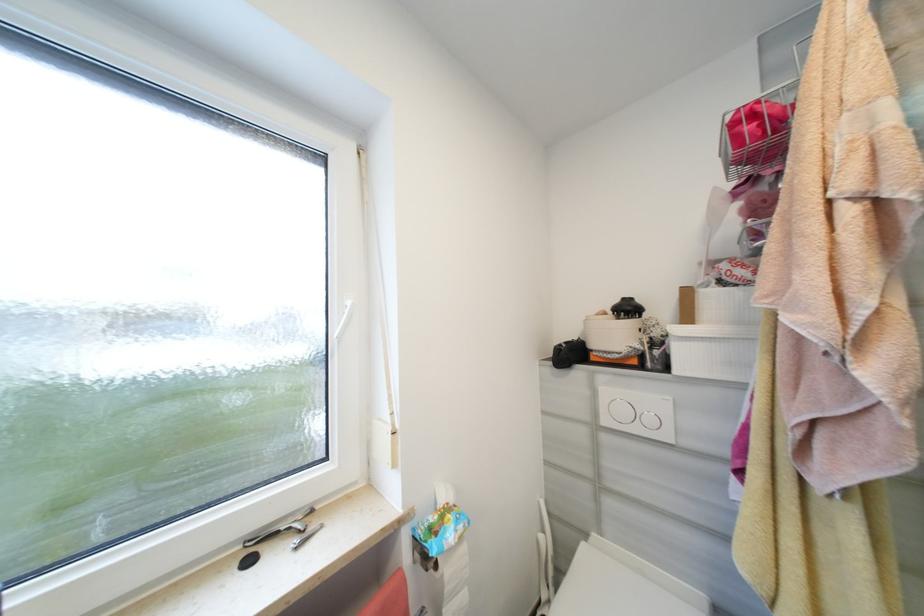
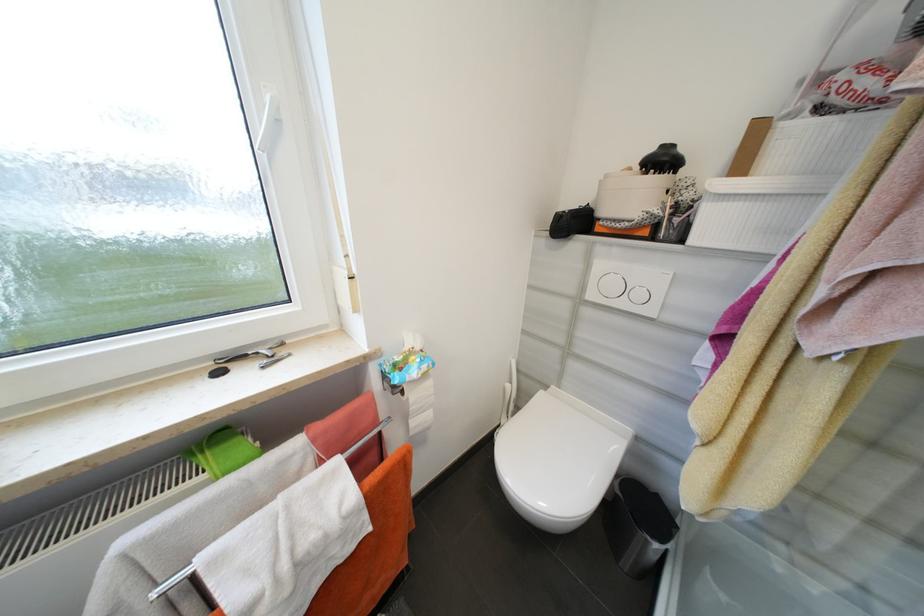
Question: I am providing you with two images of the same scene from different viewpoints. After the viewpoint changes to image2, which objects are now occluded?

Choices:
 (A) large flush button
 (B) small black bag
 (C) white window handle
 (D) none of these

Answer: (D)